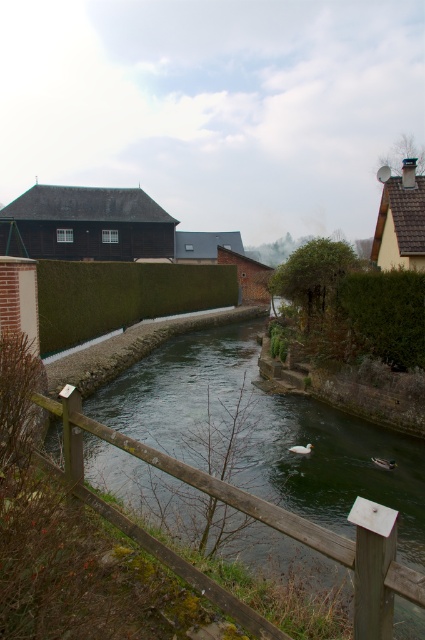
Question: Which of the following is the closest to the observer?

Choices:
 (A) (387, 620)
 (B) (376, 278)
 (C) (91, 262)

Answer: (A)

Question: In this image, where is brown wooden fence at lower center located relative to green leafy hedge at center?

Choices:
 (A) above
 (B) below

Answer: (B)

Question: Does brown wooden fence at lower center have a greater width compared to green leafy hedge at center?

Choices:
 (A) no
 (B) yes

Answer: (A)

Question: Which of the following is the farthest from the observer?

Choices:
 (A) (39, 294)
 (B) (96, 500)

Answer: (A)

Question: Which object is farther from the camera taking this photo?

Choices:
 (A) green leafy hedge at center right
 (B) green leafy hedge at center

Answer: (A)

Question: Can you confirm if brown wooden fence at lower center is wider than green leafy hedge at center right?

Choices:
 (A) yes
 (B) no

Answer: (A)